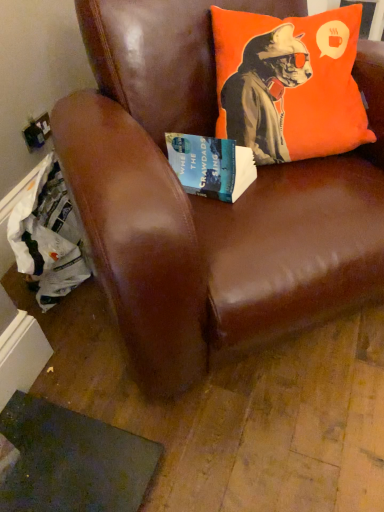
Question: From the image's perspective, is brown leather chair at upper center above or below hardcover book at center?

Choices:
 (A) below
 (B) above

Answer: (B)

Question: Would you say brown leather chair at upper center is inside or outside hardcover book at center?

Choices:
 (A) inside
 (B) outside

Answer: (B)

Question: Which of these objects is positioned farthest from the brown leather chair at upper center?

Choices:
 (A) orange fabric pillow at upper right
 (B) hardcover book at center

Answer: (B)

Question: Which is farther from the orange fabric pillow at upper right?

Choices:
 (A) hardcover book at center
 (B) brown leather chair at upper center

Answer: (A)